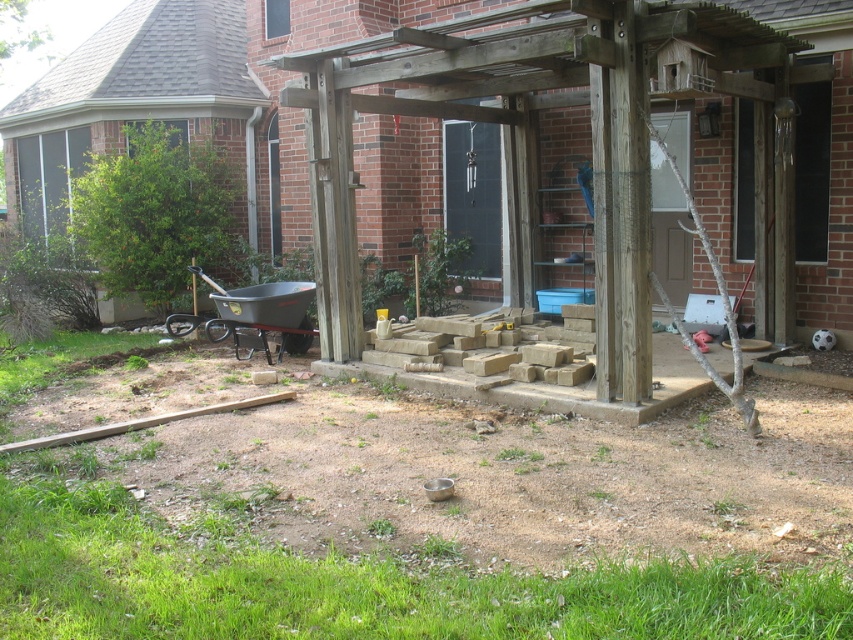
From the picture: You are standing at the entrance of the brick house and want to place a new decorative pot exactly at the wooden pergola at center. According to the coordinates provided, where should you place the pot?

The wooden pergola at center is located at point (537, 145), so you should place the decorative pot at those coordinates.